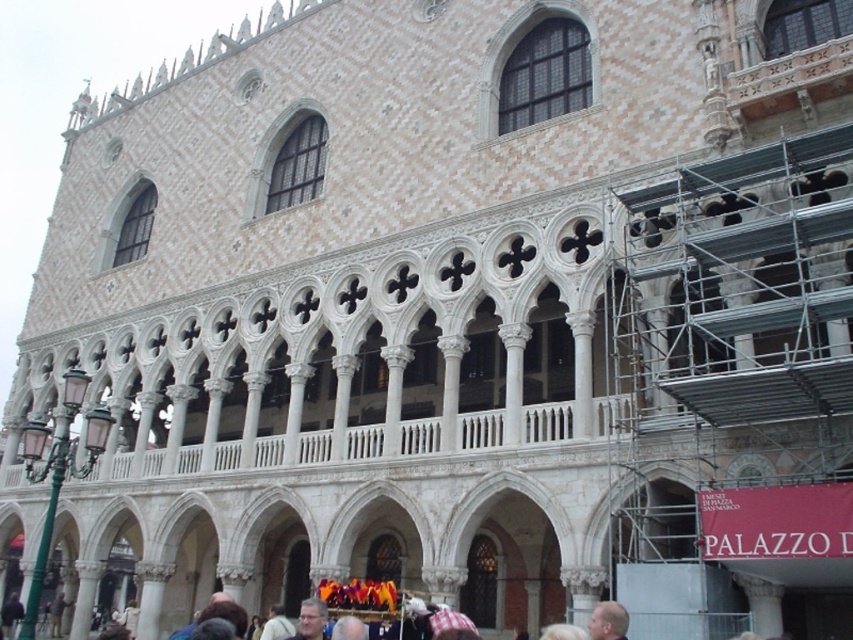
Question: Observing the image, what is the correct spatial positioning of blonde hair at lower right in reference to gray hair at center?

Choices:
 (A) left
 (B) right

Answer: (B)

Question: Does blonde hair at lower right appear on the left side of gray hair at center?

Choices:
 (A) yes
 (B) no

Answer: (B)

Question: Is blonde hair at lower right above gray hair at center?

Choices:
 (A) yes
 (B) no

Answer: (A)

Question: Which object is farther from the camera taking this photo?

Choices:
 (A) blonde hair at lower right
 (B) gray hair at center

Answer: (B)